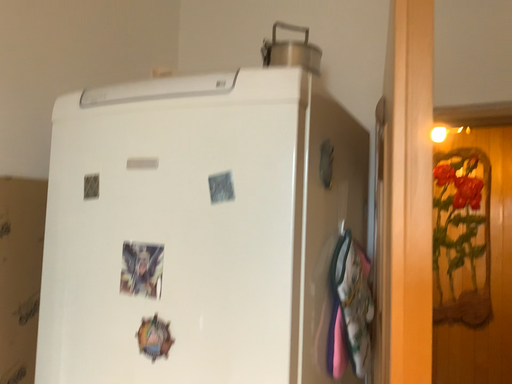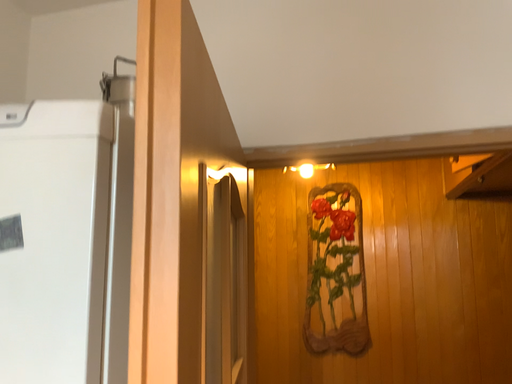
Question: Which way did the camera rotate in the video?

Choices:
 (A) rotated left
 (B) rotated right

Answer: (B)